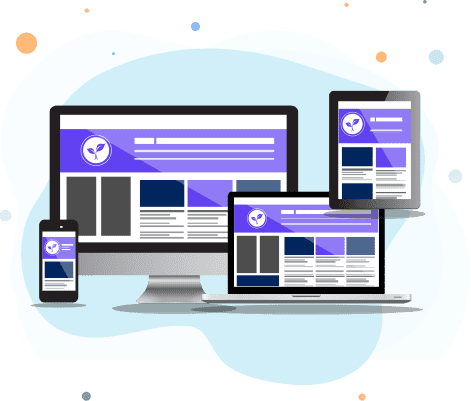
I want to click on laptop trackpad, so click(x=289, y=295), click(x=302, y=296).